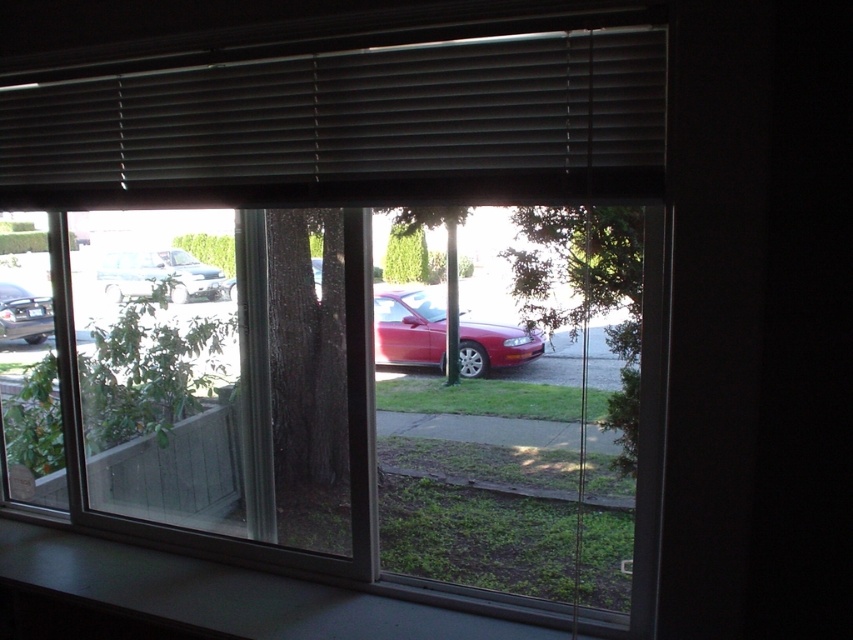
Question: Does matte gray blinds at top have a larger size compared to green leafy tree at center?

Choices:
 (A) no
 (B) yes

Answer: (A)

Question: Which object is positioned farthest from the green leafy tree at center?

Choices:
 (A) glossy red car at center
 (B) shiny black sedan at left
 (C) matte gray blinds at top

Answer: (B)

Question: Is green leafy tree at center above glossy red car at center?

Choices:
 (A) no
 (B) yes

Answer: (B)

Question: Which is nearer to the matte gray blinds at top?

Choices:
 (A) shiny black sedan at left
 (B) glossy red car at center
 (C) green leafy tree at center
 (D) matte silver sedan at left

Answer: (D)

Question: Can you confirm if green leafy tree at center is bigger than shiny black sedan at left?

Choices:
 (A) no
 (B) yes

Answer: (B)

Question: Which point is farther from the camera taking this photo?

Choices:
 (A) (613, 324)
 (B) (509, 346)
 (C) (148, 288)

Answer: (B)